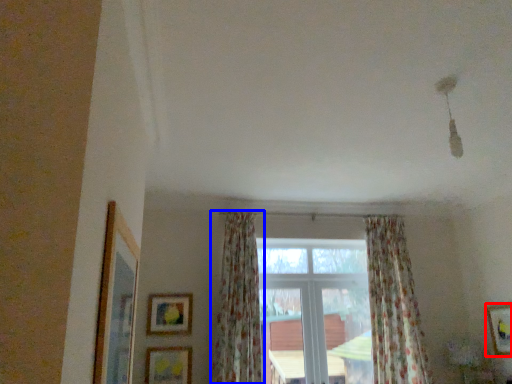
Question: Which point is further to the camera, picture frame (highlighted by a red box) or curtain (highlighted by a blue box)?

Choices:
 (A) picture frame
 (B) curtain

Answer: (A)